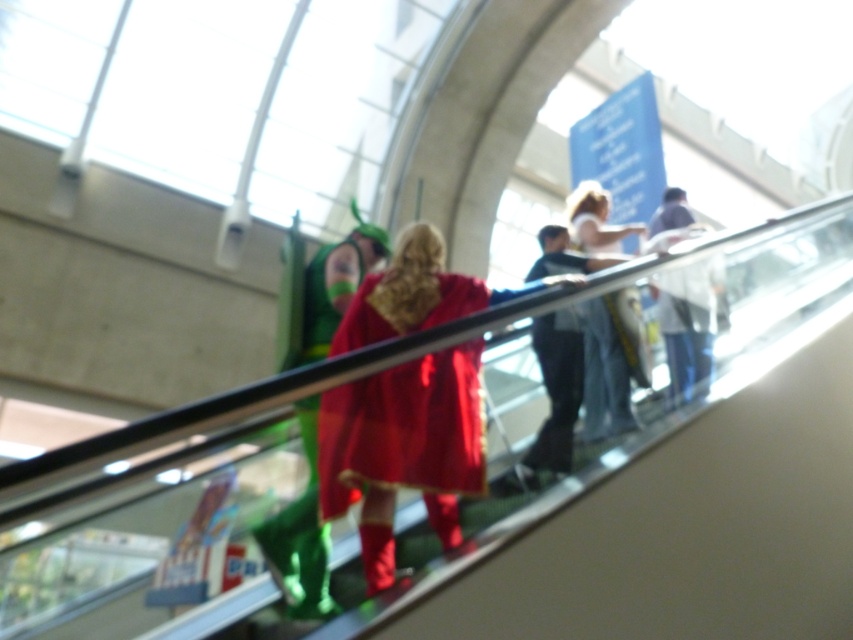
Question: Is velvet red cape at center thinner than denim jeans at center?

Choices:
 (A) no
 (B) yes

Answer: (B)

Question: Can you confirm if velvet red cape at center is positioned above denim jeans at center?

Choices:
 (A) no
 (B) yes

Answer: (A)

Question: Can you confirm if velvet red cape at center is bigger than denim jeans at center?

Choices:
 (A) yes
 (B) no

Answer: (B)

Question: Which point appears closest to the camera in this image?

Choices:
 (A) (587, 221)
 (B) (439, 289)

Answer: (B)